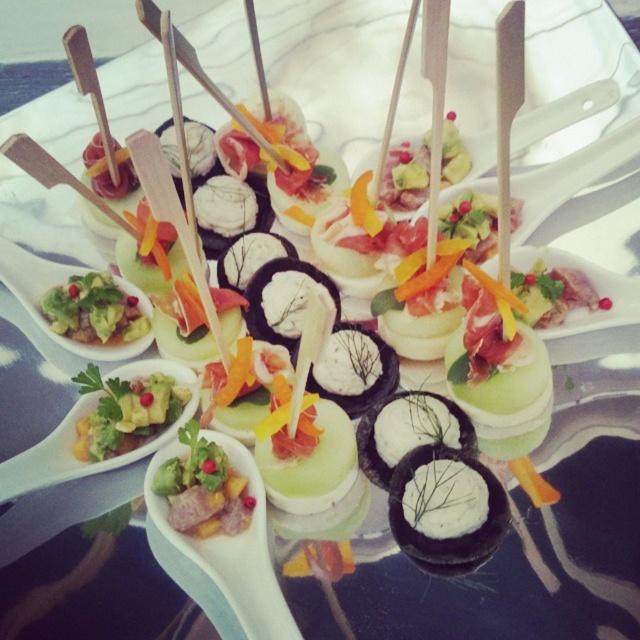
Question: Can you confirm if green leafy salad at center is positioned to the right of green avocado spread at center?

Choices:
 (A) no
 (B) yes

Answer: (B)

Question: Considering the relative positions of green guacamole at center and green avocado spread at center in the image provided, where is green guacamole at center located with respect to green avocado spread at center?

Choices:
 (A) right
 (B) left

Answer: (A)

Question: Which object appears closest to the camera in this image?

Choices:
 (A) green guacamole at center
 (B) green avocado spread at center

Answer: (A)

Question: Which object is positioned farthest from the green guacamole at center?

Choices:
 (A) green avocado spread at center
 (B) green leafy salad at center

Answer: (A)

Question: Does green guacamole at center appear over green avocado spread at center?

Choices:
 (A) no
 (B) yes

Answer: (A)

Question: Which of the following is the closest to the observer?

Choices:
 (A) [128, 340]
 (B) [145, 429]
 (C) [236, 506]

Answer: (C)